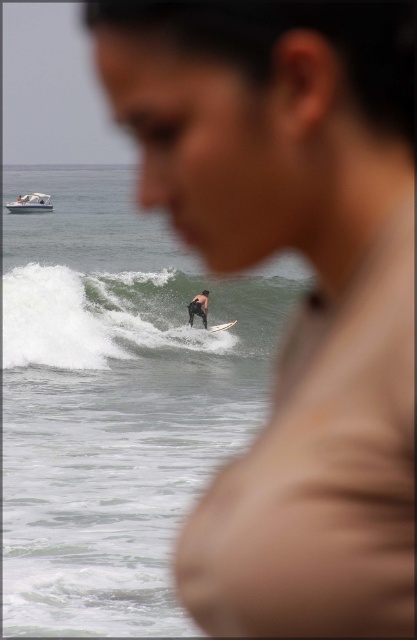
Between white foam wave at center and white plastic boat at upper left, which one appears on the right side from the viewer's perspective?

Positioned to the right is white foam wave at center.

Which is behind, point (278, 300) or point (42, 202)?

Positioned behind is point (42, 202).

The width and height of the screenshot is (417, 640). I want to click on white foam wave at center, so click(132, 316).

Is white plastic boat at upper left shorter than black neoprene wetsuit at center?

In fact, white plastic boat at upper left may be taller than black neoprene wetsuit at center.

Which is in front, point (45, 202) or point (203, 310)?

Point (203, 310)

Image resolution: width=417 pixels, height=640 pixels. What do you see at coordinates (30, 204) in the screenshot?
I see `white plastic boat at upper left` at bounding box center [30, 204].

Identify the location of white plastic boat at upper left. (30, 204).

Describe the element at coordinates (30, 204) in the screenshot. I see `white plastic boat at upper left` at that location.

Is white plastic boat at upper left to the left of white glossy surfboard at center from the viewer's perspective?

Indeed, white plastic boat at upper left is positioned on the left side of white glossy surfboard at center.

What are the coordinates of `white plastic boat at upper left` in the screenshot? It's located at (30, 204).

I want to click on white plastic boat at upper left, so click(x=30, y=204).